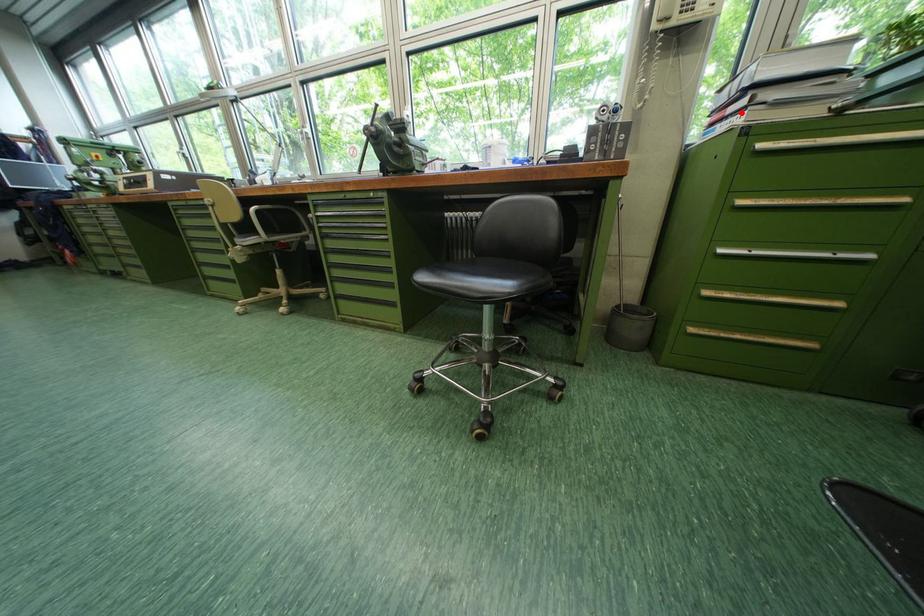
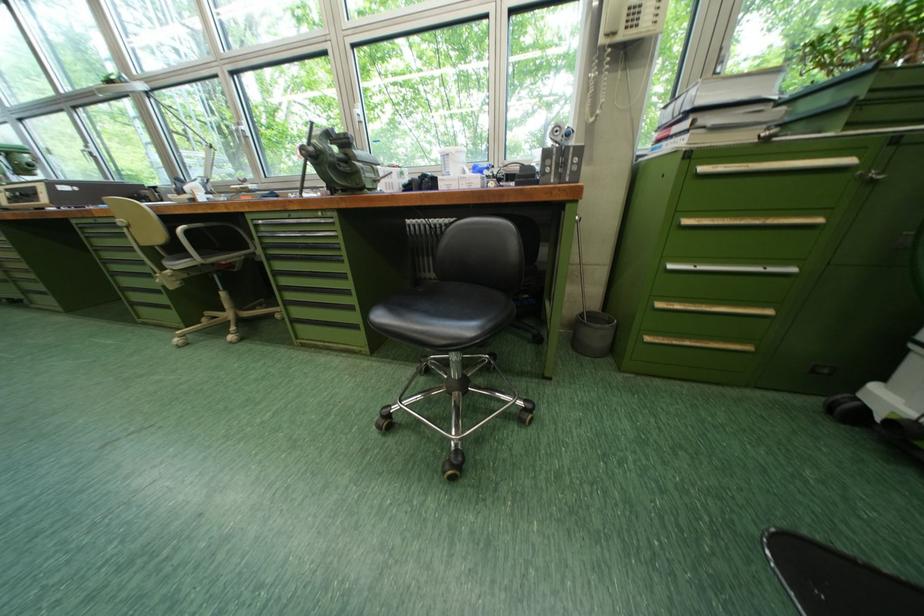
In the second image, find the point that corresponds to the highlighted location in the first image.

(686, 132)